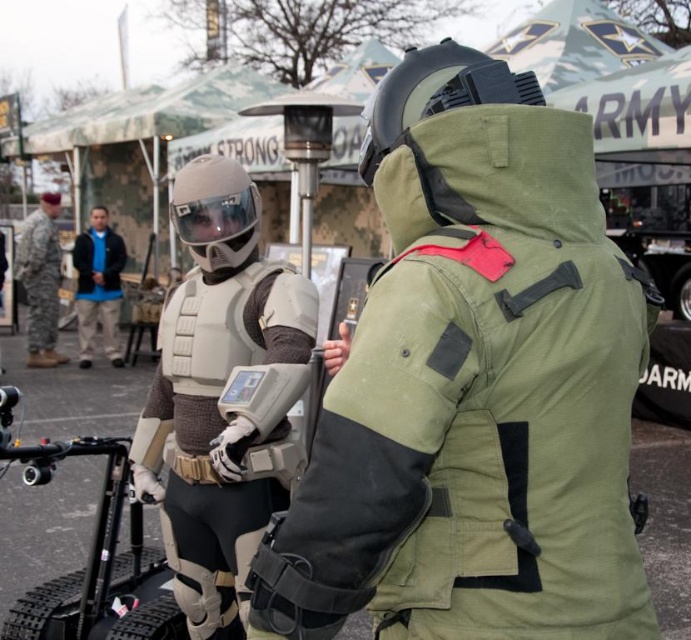
You are a security guard at the event and need to inspect the equipment. You see the matte gray armor at center and the matte white helmet at center. Which object is positioned to the right of the other?

The matte gray armor at center is to the right of the matte white helmet at center.

You are a security guard at the event. You need to check both the matte gray armor at center and the blue fleece jacket at center. The path between them is 8.16 meters. If your security device has a maximum scanning range of 8 meters, will you be able to scan both objects without moving closer?

The distance between the matte gray armor at center and the blue fleece jacket at center is 8.16 meters. Since the security device can only scan up to 8 meters, you will need to move closer to scan both objects individually within the device range.